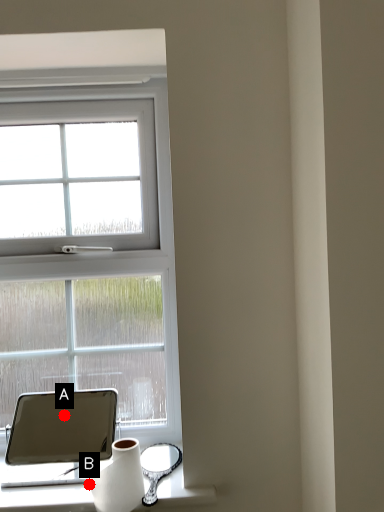
Question: Two points are circled on the image, labeled by A and B beside each circle. Among these points, which one is nearest to the camera?

Choices:
 (A) A is closer
 (B) B is closer

Answer: (B)